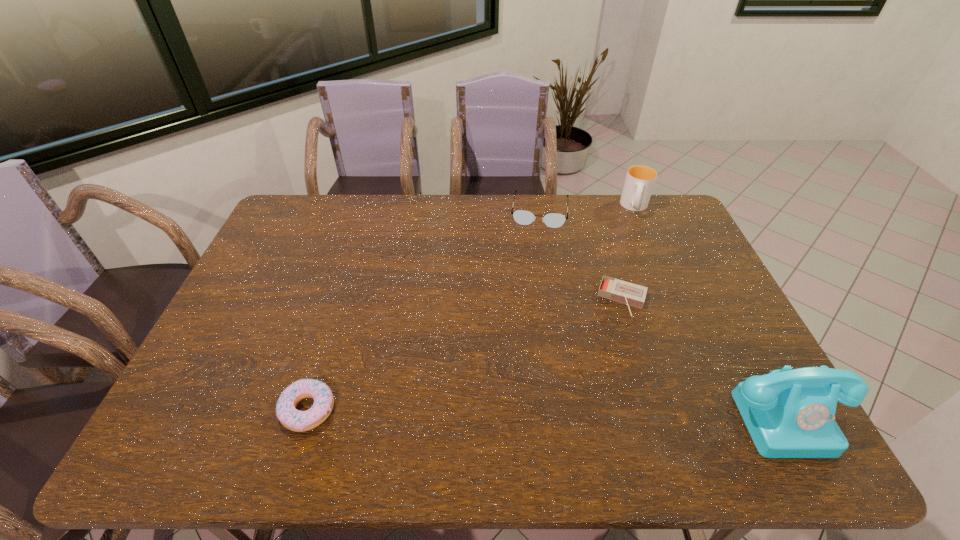
This screenshot has height=540, width=960. Find the location of `free location at the far right corner`. free location at the far right corner is located at coordinates (654, 213).

Locate an element on the screen. Image resolution: width=960 pixels, height=540 pixels. vacant space in between the third farthest object and the second object from left to right is located at coordinates (581, 255).

Where is `free spot between the tallest object and the matchbox`? The image size is (960, 540). free spot between the tallest object and the matchbox is located at coordinates (706, 356).

The height and width of the screenshot is (540, 960). Identify the location of free spot between the telephone and the spectacles. (664, 312).

I want to click on free space between the telephone and the leftmost object, so click(548, 411).

The height and width of the screenshot is (540, 960). Identify the location of free spot between the leftmost object and the fourth shortest object. (471, 309).

This screenshot has height=540, width=960. Find the location of `free point between the doughnut and the third shortest object`. free point between the doughnut and the third shortest object is located at coordinates (423, 311).

This screenshot has height=540, width=960. I want to click on empty space that is in between the third nearest object and the fourth shortest object, so 629,253.

Locate an element on the screen. The width and height of the screenshot is (960, 540). vacant region between the third nearest object and the telephone is located at coordinates (706, 356).

Image resolution: width=960 pixels, height=540 pixels. I want to click on empty space that is in between the third farthest object and the third tallest object, so click(581, 255).